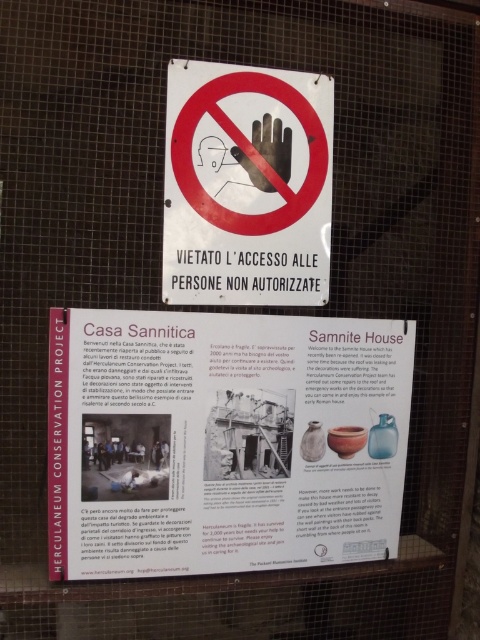
user is a delivery person who needs to attach a new notice to the fence. The notice is 15 cm wide. The user wants to place it to the right of the white paper at center and matte white sign at center. Can the notice fit there without overlapping either object?

The white paper at center is wider than the matte white sign at center. Since the notice is 15 cm wide, but we don not have exact measurements of the space between them, it is uncertain if there is enough space. The user should measure the gap before attaching the notice.

user is a delivery person who needs to attach a notice to the fence. They have a notice that is 15 cm in height. They want to know if the notice will fit between the white paper at center and the matte white sign at center. What should they do?

The white paper at center has a greater height compared to matte white sign at center. Since the notice is 15 cm in height, it can fit between them as long as the vertical space between the two objects is sufficient. However, without knowing the exact distance between them, it is recommended to measure the space before attaching the notice.